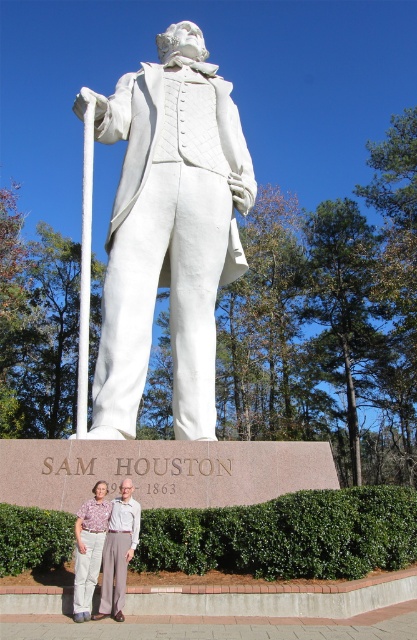
Question: Which point appears closest to the camera in this image?

Choices:
 (A) (82, 522)
 (B) (163, 38)

Answer: (A)

Question: Which object appears farthest from the camera in this image?

Choices:
 (A) light brown fabric pants at lower center
 (B) white marble statue at center

Answer: (B)

Question: Does white marble statue at center appear on the right side of light brown fabric pants at lower center?

Choices:
 (A) yes
 (B) no

Answer: (B)

Question: Does white marble statue at center appear on the left side of light brown fabric pants at lower center?

Choices:
 (A) no
 (B) yes

Answer: (B)

Question: In this image, where is white marble statue at center located relative to light brown fabric pants at lower center?

Choices:
 (A) left
 (B) right

Answer: (A)

Question: Which point appears farthest from the camera in this image?

Choices:
 (A) (138, 522)
 (B) (228, 211)

Answer: (B)